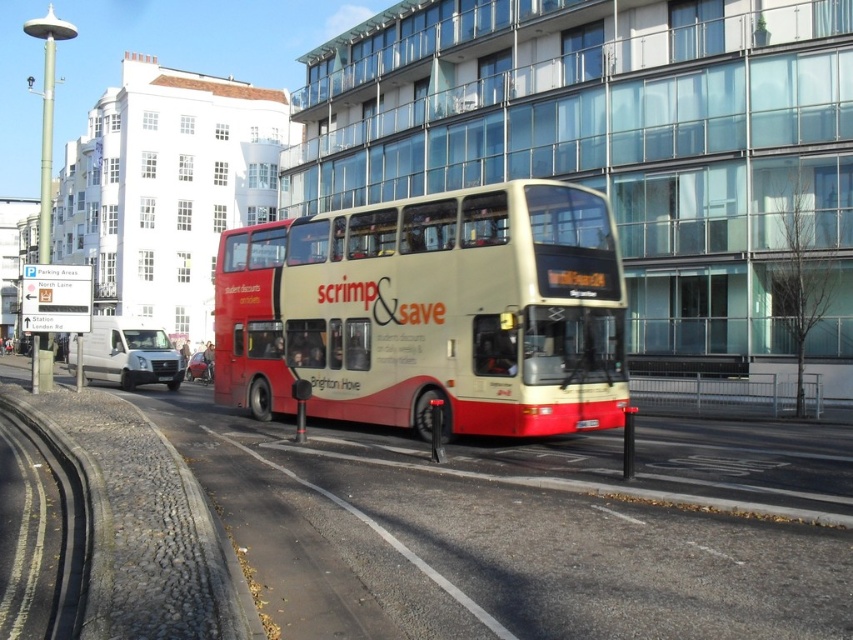
You are standing at the point with coordinates [430,312] in the scene. What object are you currently standing on?

The point with coordinates [430,312] is on the matte cream double decker bus at center.

You are a photographer standing at the center of the street. You want to take a photo of both point (612,234) and point (576,424) in the scene. Which point is closer to your camera?

Point (576,424) is closer to the camera because it is less further away than point (612,234).